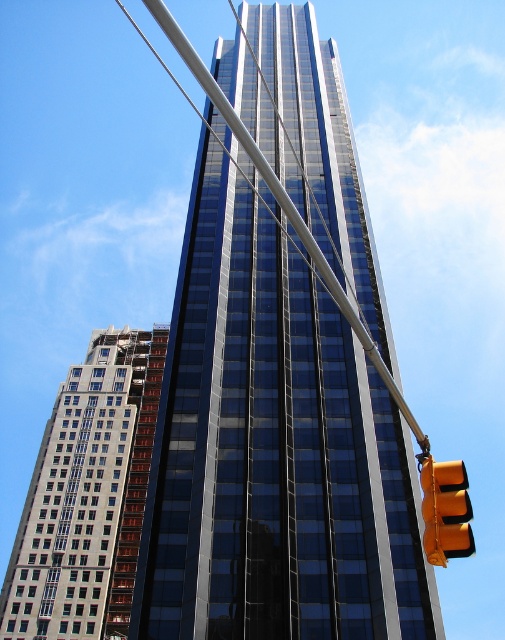
Is glossy glass skyscraper at center above gray concrete building at left?

Indeed, glossy glass skyscraper at center is positioned over gray concrete building at left.

Is glossy glass skyscraper at center to the left of gray concrete building at left from the viewer's perspective?

Incorrect, glossy glass skyscraper at center is not on the left side of gray concrete building at left.

Between point (294, 358) and point (155, 346), which one is positioned in front?

Point (294, 358)

Find the location of a particular element. The image size is (505, 640). glossy glass skyscraper at center is located at coordinates (279, 376).

Between glossy glass skyscraper at center and yellow matte traffic light at lower right, which one is positioned lower?

Positioned lower is yellow matte traffic light at lower right.

Is glossy glass skyscraper at center to the right of yellow matte traffic light at lower right from the viewer's perspective?

Incorrect, glossy glass skyscraper at center is not on the right side of yellow matte traffic light at lower right.

Which is behind, point (244, 545) or point (433, 561)?

The point (244, 545) is more distant.

The width and height of the screenshot is (505, 640). I want to click on glossy glass skyscraper at center, so click(x=279, y=376).

Based on the photo, can you confirm if gray concrete building at left is bigger than yellow matte traffic light at lower right?

Indeed, gray concrete building at left has a larger size compared to yellow matte traffic light at lower right.

Between gray concrete building at left and yellow matte traffic light at lower right, which one has less height?

yellow matte traffic light at lower right

The height and width of the screenshot is (640, 505). Describe the element at coordinates (87, 496) in the screenshot. I see `gray concrete building at left` at that location.

Locate an element on the screen. The width and height of the screenshot is (505, 640). gray concrete building at left is located at coordinates (87, 496).